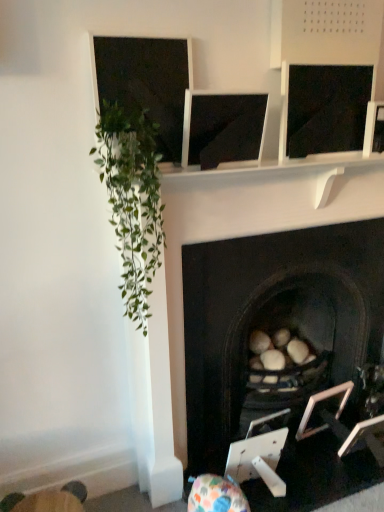
Question: From the image's perspective, would you say matte black monitor at center is shown under wooden swivel chair at lower left?

Choices:
 (A) yes
 (B) no

Answer: (B)

Question: Is matte black monitor at center wider than wooden swivel chair at lower left?

Choices:
 (A) no
 (B) yes

Answer: (A)

Question: Is matte black monitor at center closer to the viewer compared to wooden swivel chair at lower left?

Choices:
 (A) yes
 (B) no

Answer: (A)

Question: Are matte black monitor at center and wooden swivel chair at lower left beside each other?

Choices:
 (A) yes
 (B) no

Answer: (B)

Question: From a real-world perspective, does matte black monitor at center stand above wooden swivel chair at lower left?

Choices:
 (A) yes
 (B) no

Answer: (A)

Question: Looking at their shapes, would you say matte black monitor at center is wider or thinner than black stone fireplace at center?

Choices:
 (A) wide
 (B) thin

Answer: (B)

Question: Is point (226, 112) positioned closer to the camera than point (190, 283)?

Choices:
 (A) farther
 (B) closer

Answer: (B)

Question: Would you say matte black monitor at center is to the left or to the right of black stone fireplace at center in the picture?

Choices:
 (A) right
 (B) left

Answer: (B)

Question: From the image's perspective, is matte black monitor at center positioned above or below black stone fireplace at center?

Choices:
 (A) above
 (B) below

Answer: (A)

Question: From the image's perspective, is metallic silver picture frame at lower right, marked as the 2th picture frame in a right-to-left arrangement, located above or below matte black monitor at center?

Choices:
 (A) below
 (B) above

Answer: (A)

Question: Would you say metallic silver picture frame at lower right, marked as the 2th picture frame in a right-to-left arrangement, is to the left or to the right of matte black monitor at center in the picture?

Choices:
 (A) left
 (B) right

Answer: (B)

Question: In the image, is metallic silver picture frame at lower right, marked as the 2th picture frame in a right-to-left arrangement, positioned in front of or behind matte black monitor at center?

Choices:
 (A) behind
 (B) front

Answer: (A)

Question: Considering the positions of point (314, 399) and point (200, 99), is point (314, 399) closer or farther from the camera than point (200, 99)?

Choices:
 (A) closer
 (B) farther

Answer: (B)

Question: From the image's perspective, is black stone fireplace at center located above or below metallic silver picture frame at lower right, marked as the 2th picture frame in a right-to-left arrangement?

Choices:
 (A) below
 (B) above

Answer: (B)

Question: Do you think black stone fireplace at center is within metallic silver picture frame at lower right, arranged as the 1th picture frame when viewed from the left, or outside of it?

Choices:
 (A) outside
 (B) inside

Answer: (A)